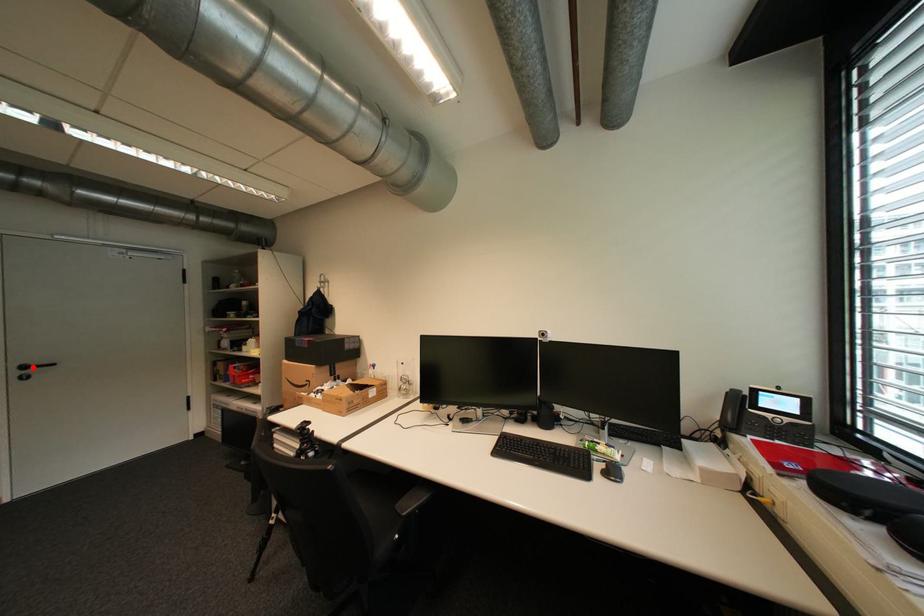
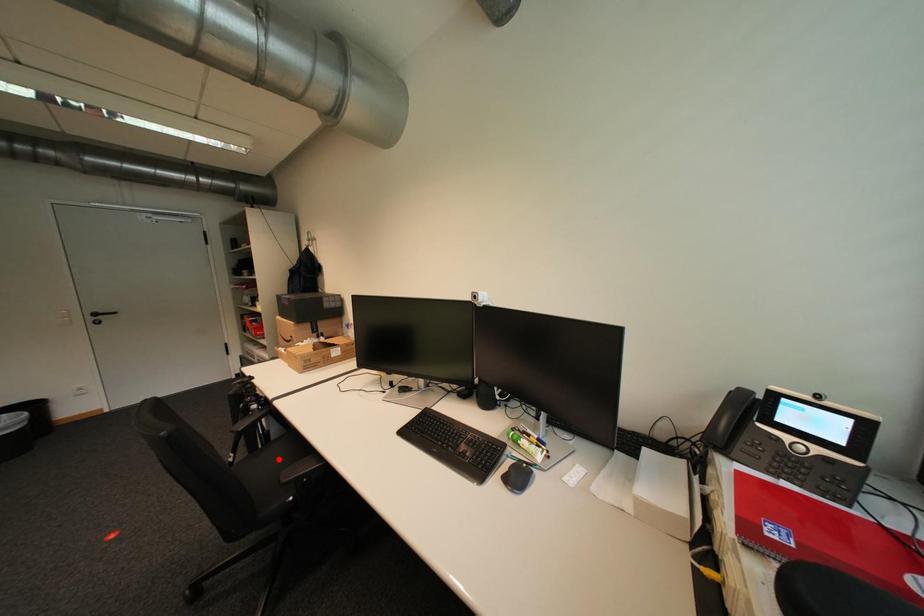
I am providing you with two images of the same scene from different viewpoints. A red point is marked on the first image and another point is marked on the second image. Are the points marked in image1 and image2 representing the same 3D position?

No